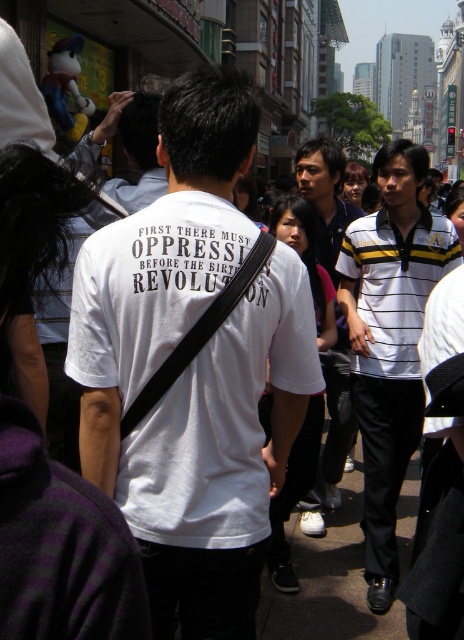
You are standing in the middle of the urban street scene and want to take a photo of both the bold message on the white T shirt and the crowd. Which point, point 1 at coordinates (233, 333) or point 2 at coordinates (356, 310), should you focus on first to ensure the bold message on the white T shirt is in sharp focus?

Point 1 at coordinates (233, 333) is closer to the camera than point 2 at coordinates (356, 310). To ensure the bold message on the white T shirt is in sharp focus, you should focus on point 1 first.

You are a photographer trying to capture the central figure in the scene. You notice a person wearing a white striped polo shirt at center. Where exactly is this person positioned relative to the central figure?

The white striped polo shirt at center is located at point (390, 340), meaning it is positioned to the right and slightly above the central figure.